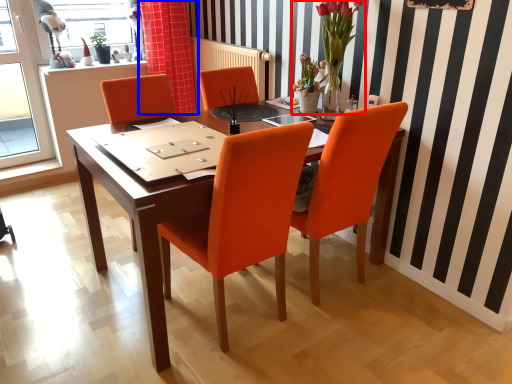
Question: Which object appears farthest to the camera in this image, floral arrangement (highlighted by a red box) or curtain (highlighted by a blue box)?

Choices:
 (A) floral arrangement
 (B) curtain

Answer: (B)